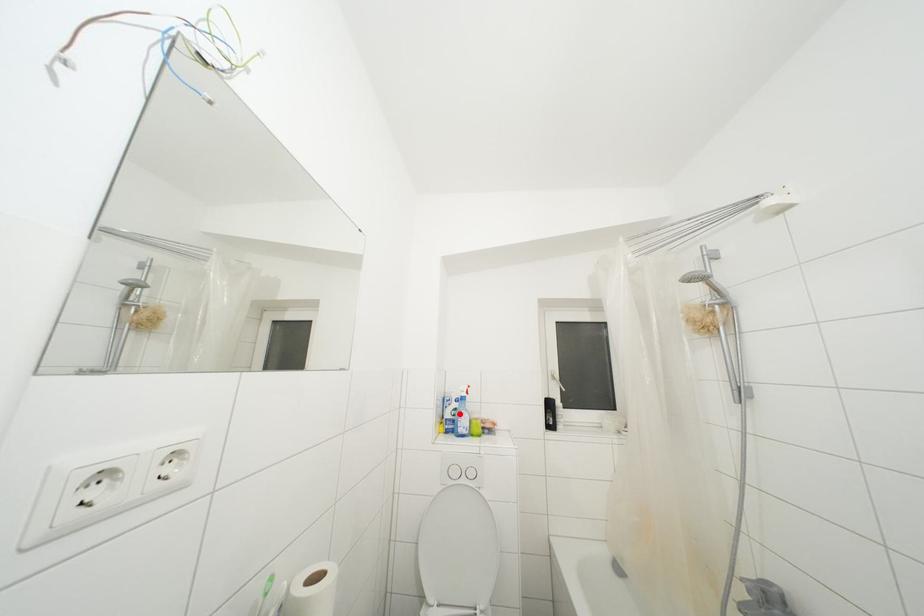
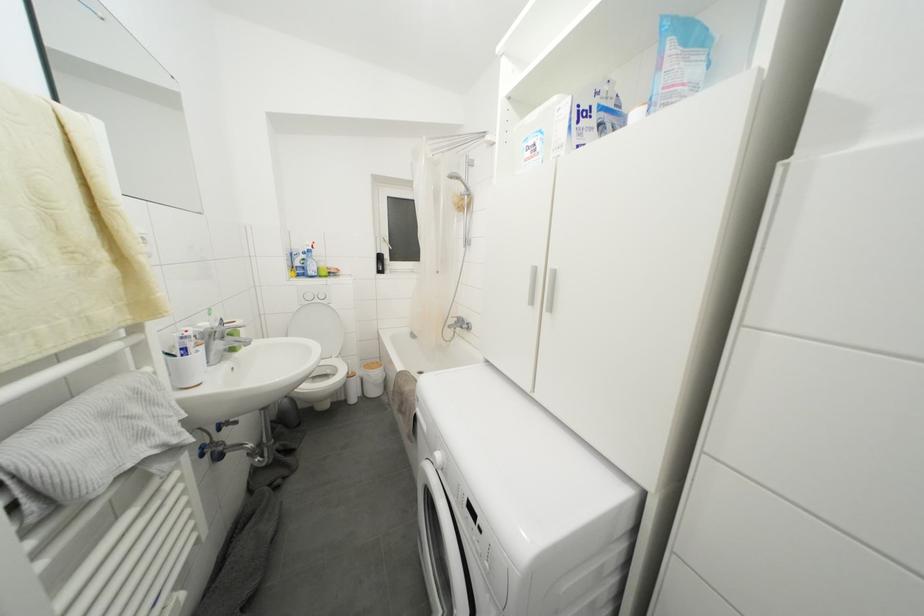
Question: I am providing you with two images of the same scene from different viewpoints. In image1, a red point is highlighted. Considering the same 3D point in image2, which of the following is correct?

Choices:
 (A) It is closer
 (B) It is farther

Answer: (A)